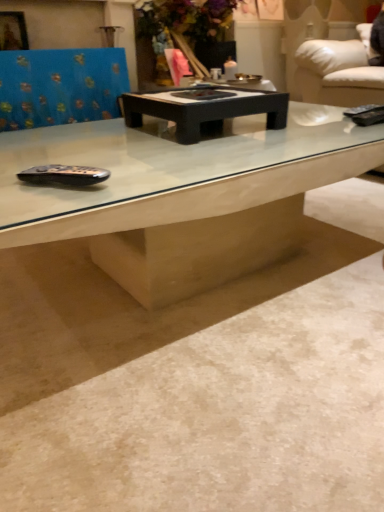
Question: From the image's perspective, is white marble concrete at center above blue fabric swivel chair at upper left?

Choices:
 (A) no
 (B) yes

Answer: (A)

Question: Is white marble concrete at center turned away from blue fabric swivel chair at upper left?

Choices:
 (A) no
 (B) yes

Answer: (A)

Question: Is there a large distance between white marble concrete at center and blue fabric swivel chair at upper left?

Choices:
 (A) yes
 (B) no

Answer: (A)

Question: Is white marble concrete at center bigger than blue fabric swivel chair at upper left?

Choices:
 (A) no
 (B) yes

Answer: (B)

Question: Can you confirm if white marble concrete at center is shorter than blue fabric swivel chair at upper left?

Choices:
 (A) yes
 (B) no

Answer: (A)

Question: From a real-world perspective, does white marble concrete at center sit lower than blue fabric swivel chair at upper left?

Choices:
 (A) yes
 (B) no

Answer: (A)

Question: Can white marble concrete at center be found inside blue fabric swivel chair at upper left?

Choices:
 (A) yes
 (B) no

Answer: (B)

Question: Is blue fabric swivel chair at upper left taller than white marble concrete at center?

Choices:
 (A) no
 (B) yes

Answer: (B)

Question: Does blue fabric swivel chair at upper left have a lesser width compared to white marble concrete at center?

Choices:
 (A) no
 (B) yes

Answer: (B)

Question: Considering the relative positions of blue fabric swivel chair at upper left and white marble concrete at center in the image provided, is blue fabric swivel chair at upper left behind white marble concrete at center?

Choices:
 (A) yes
 (B) no

Answer: (A)

Question: From a real-world perspective, is blue fabric swivel chair at upper left on white marble concrete at center?

Choices:
 (A) no
 (B) yes

Answer: (B)

Question: Can we say blue fabric swivel chair at upper left lies outside white marble concrete at center?

Choices:
 (A) yes
 (B) no

Answer: (A)

Question: From the image's perspective, would you say black matte coffee table at center is positioned over blue fabric swivel chair at upper left?

Choices:
 (A) yes
 (B) no

Answer: (B)